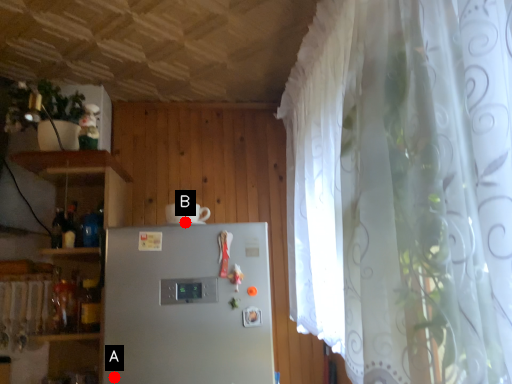
Question: Two points are circled on the image, labeled by A and B beside each circle. Among these points, which one is farthest from the camera?

Choices:
 (A) A is further
 (B) B is further

Answer: (B)